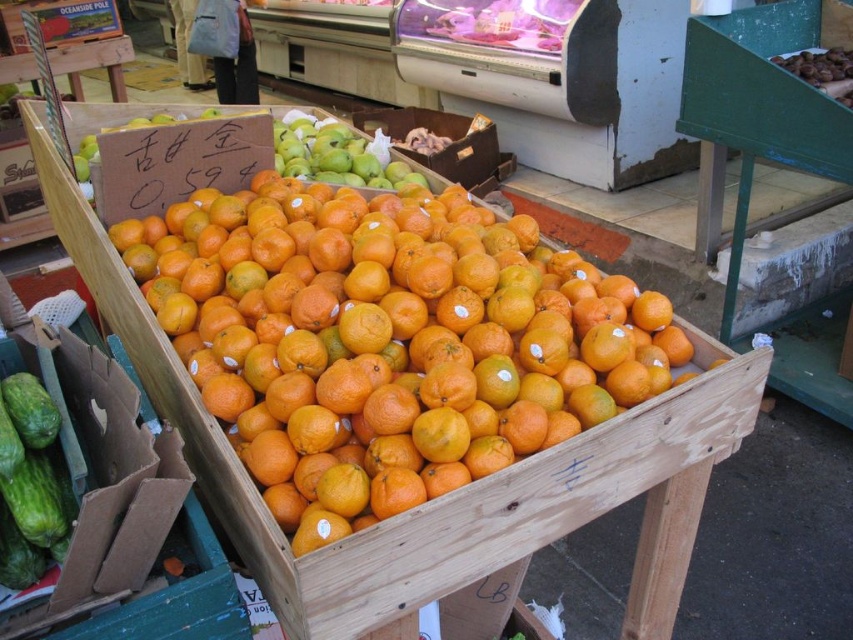
In the scene shown: You are a customer at the market stall and want to buy the orange matte at center located at point (387, 340). The vendor asks you to point to the exact location of the orange matte at center. Can you describe its position relative to the wooden crate filled with oranges?

The orange matte at center is located at point (387, 340), which is the exact position of the wooden crate filled with oranges. Therefore, the orange matte at center is on the wooden crate filled with oranges.

You are standing at the center of the market stall and want to pick up the green matte cucumber at lower left. If you face the wooden crate with oranges, which direction should you turn to reach it?

Since the green matte cucumber at lower left is located at point (28, 483) in 2D coordinates, you should turn to your left to reach it.